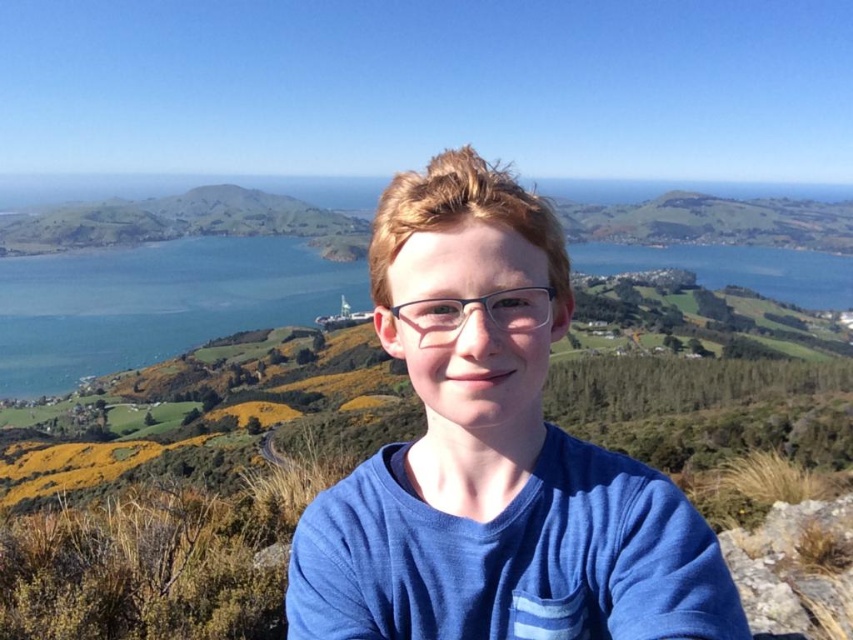
Does blue cotton shirt at center appear on the left side of clear plastic glasses at center?

In fact, blue cotton shirt at center is to the right of clear plastic glasses at center.

Does blue cotton shirt at center have a greater height compared to clear plastic glasses at center?

Indeed, blue cotton shirt at center has a greater height compared to clear plastic glasses at center.

Does point (523, 550) come in front of point (466, 316)?

That is True.

The width and height of the screenshot is (853, 640). I want to click on blue cotton shirt at center, so click(492, 456).